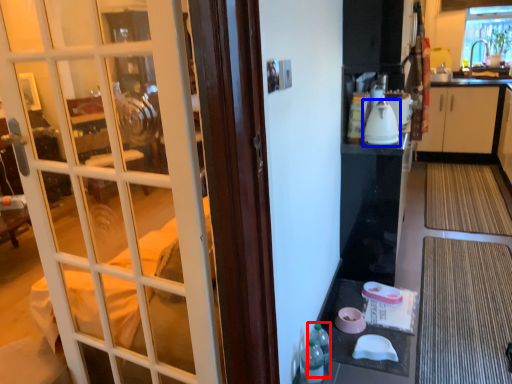
Question: Which point is further to the camera, bottle (highlighted by a red box) or kitchen appliance (highlighted by a blue box)?

Choices:
 (A) bottle
 (B) kitchen appliance

Answer: (B)